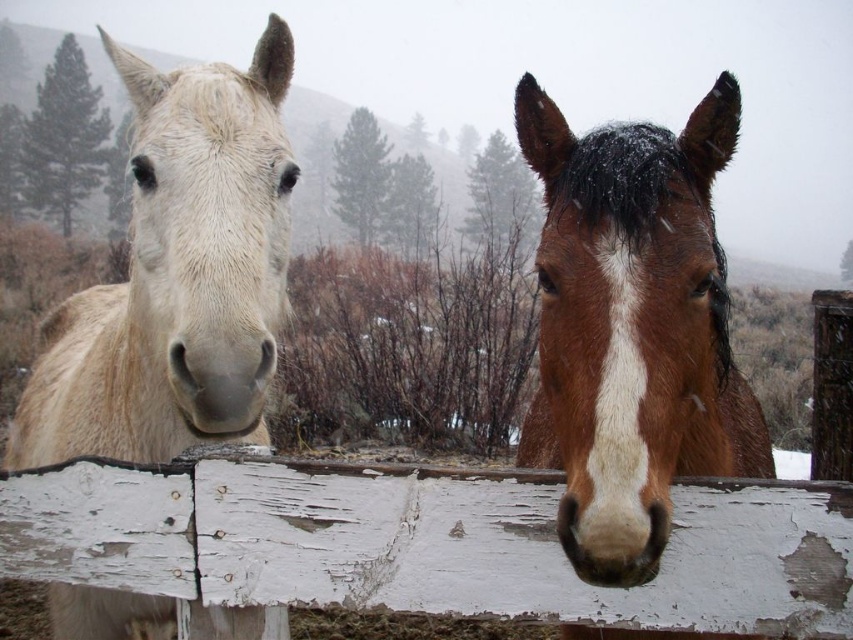
Question: Based on their relative distances, which object is nearer to the white matte horse nose at left?

Choices:
 (A) light beige fur at left
 (B) white peeling wood at center
 (C) brown shiny horse at center

Answer: (B)

Question: Is white peeling wood at center closer to the viewer compared to light beige fur at left?

Choices:
 (A) yes
 (B) no

Answer: (A)

Question: Can you confirm if white peeling wood at center is bigger than brown shiny horse at center?

Choices:
 (A) no
 (B) yes

Answer: (A)

Question: Which object is closer to the camera taking this photo?

Choices:
 (A) light beige fur at left
 (B) white peeling wood at center

Answer: (B)

Question: Estimate the real-world distances between objects in this image. Which object is closer to the white peeling wood at center?

Choices:
 (A) white matte horse nose at left
 (B) light beige fur at left
 (C) brown shiny horse at center

Answer: (A)

Question: In this image, where is brown shiny horse at center located relative to light beige fur at left?

Choices:
 (A) left
 (B) right

Answer: (B)